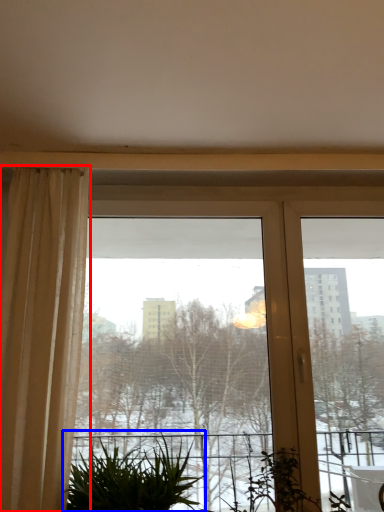
Question: Among these objects, which one is nearest to the camera, curtain (highlighted by a red box) or houseplant (highlighted by a blue box)?

Choices:
 (A) curtain
 (B) houseplant

Answer: (A)